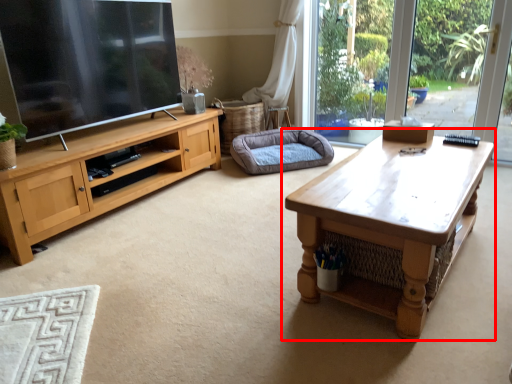
Question: From the image's perspective, where is coffee table (annotated by the red box) located relative to dog bed?

Choices:
 (A) below
 (B) above

Answer: (A)